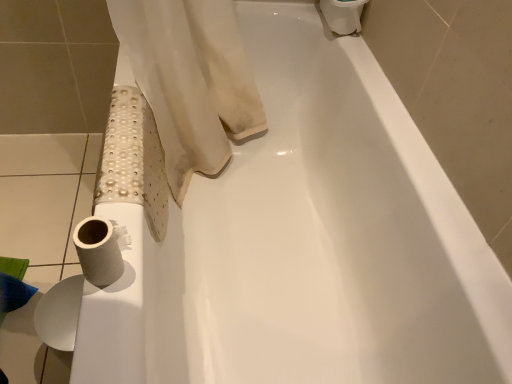
I want to click on free space in front of white matte toilet paper at lower left, the 3th toilet paper in the back-to-front sequence, so click(x=106, y=328).